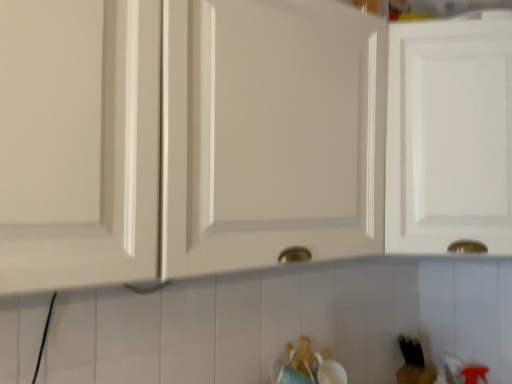
Question: Does white glossy cabinet at center, the second cabinetry when ordered from right to left, have a greater height compared to black matte bear at lower right, the first toy in the bottom-to-top sequence?

Choices:
 (A) yes
 (B) no

Answer: (A)

Question: From a real-world perspective, is white glossy cabinet at center, the second cabinetry when ordered from right to left, located higher than black matte bear at lower right, the second toy positioned from the front?

Choices:
 (A) yes
 (B) no

Answer: (A)

Question: Does white glossy cabinet at center, the second cabinetry when ordered from right to left, appear on the left side of black matte bear at lower right, which appears as the 1th toy when viewed from the right?

Choices:
 (A) no
 (B) yes

Answer: (B)

Question: Is white glossy cabinet at center, the first cabinetry positioned from the left, positioned in front of black matte bear at lower right, which appears as the 1th toy when viewed from the right?

Choices:
 (A) no
 (B) yes

Answer: (B)

Question: Is white glossy cabinet at center, the first cabinetry positioned from the left, aimed at black matte bear at lower right, the first toy in the bottom-to-top sequence?

Choices:
 (A) yes
 (B) no

Answer: (B)

Question: From the image's perspective, is brown plush bear at lower center, the first toy from the top, positioned above or below white glossy cabinet door at upper right, the 2th cabinetry positioned from the left?

Choices:
 (A) above
 (B) below

Answer: (B)

Question: In terms of width, does brown plush bear at lower center, the first toy from the top, look wider or thinner when compared to white glossy cabinet door at upper right, the first cabinetry when ordered from right to left?

Choices:
 (A) wide
 (B) thin

Answer: (B)

Question: From a real-world perspective, is brown plush bear at lower center, positioned as the second toy in back-to-front order, positioned above or below white glossy cabinet door at upper right, the 2th cabinetry positioned from the left?

Choices:
 (A) below
 (B) above

Answer: (A)

Question: Is point (287, 349) positioned closer to the camera than point (446, 240)?

Choices:
 (A) farther
 (B) closer

Answer: (A)

Question: Is point (411, 362) positioned closer to the camera than point (499, 162)?

Choices:
 (A) closer
 (B) farther

Answer: (B)

Question: Is black matte bear at lower right, the first toy in the bottom-to-top sequence, inside the boundaries of white glossy cabinet door at upper right, the 2th cabinetry positioned from the left, or outside?

Choices:
 (A) inside
 (B) outside

Answer: (B)

Question: From their relative heights in the image, would you say black matte bear at lower right, the first toy in the bottom-to-top sequence, is taller or shorter than white glossy cabinet door at upper right, the first cabinetry when ordered from right to left?

Choices:
 (A) short
 (B) tall

Answer: (A)

Question: From the image's perspective, relative to white glossy cabinet door at upper right, the first cabinetry when ordered from right to left, is black matte bear at lower right, positioned as the 2th toy in left-to-right order, above or below?

Choices:
 (A) above
 (B) below

Answer: (B)

Question: Considering their positions, is white glossy cabinet at center, the first cabinetry positioned from the left, located in front of or behind brown plush bear at lower center, the 2th toy when ordered from right to left?

Choices:
 (A) behind
 (B) front

Answer: (B)

Question: Would you say white glossy cabinet at center, the second cabinetry when ordered from right to left, is inside or outside brown plush bear at lower center, positioned as the first toy in front-to-back order?

Choices:
 (A) inside
 (B) outside

Answer: (B)